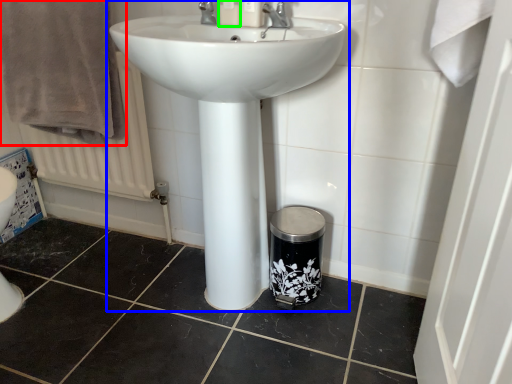
Question: Considering the real-world distances, which object is farthest from bath towel (highlighted by a red box)? sink (highlighted by a blue box) or toiletry (highlighted by a green box)?

Choices:
 (A) sink
 (B) toiletry

Answer: (B)